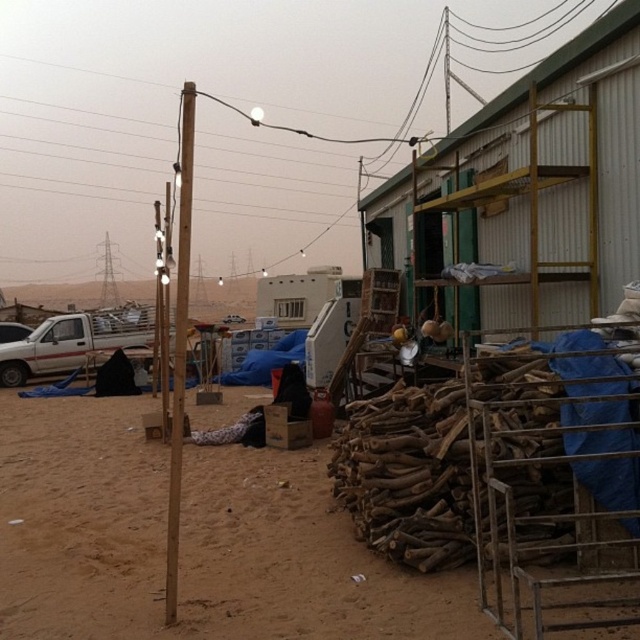
You are a photographer setting up a shot in the desert scene. You have a white matte truck at left and a brown wooden pole at center in your frame. Which object appears narrower in the photo?

The white matte truck at left appears narrower than the brown wooden pole at center.

You are standing at the center of the desert scene. You need to place a small tent. Where should you set it up so that it is on the brown sandy dirt at lower left?

The brown sandy dirt at lower left is located at point (192, 540), so you should set up the tent there.